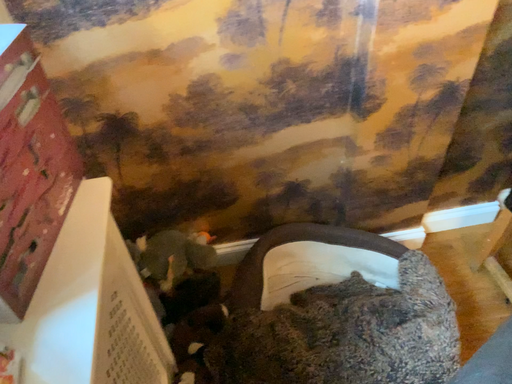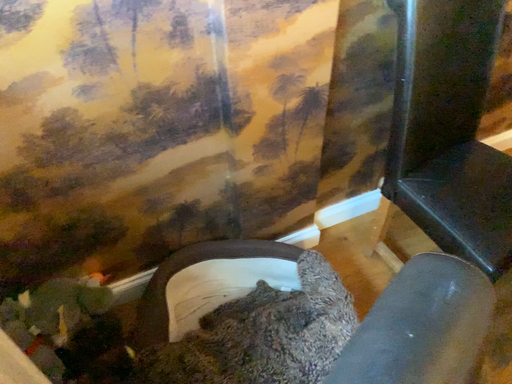
Question: How did the camera likely rotate when shooting the video?

Choices:
 (A) rotated right
 (B) rotated left

Answer: (A)